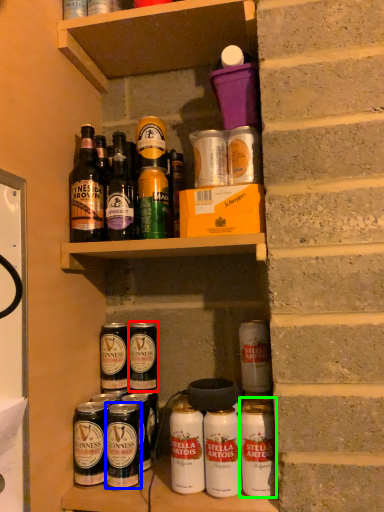
Question: Considering the real-world distances, which object is farthest from beer (highlighted by a red box)? beverage (highlighted by a blue box) or beer (highlighted by a green box)?

Choices:
 (A) beverage
 (B) beer

Answer: (B)